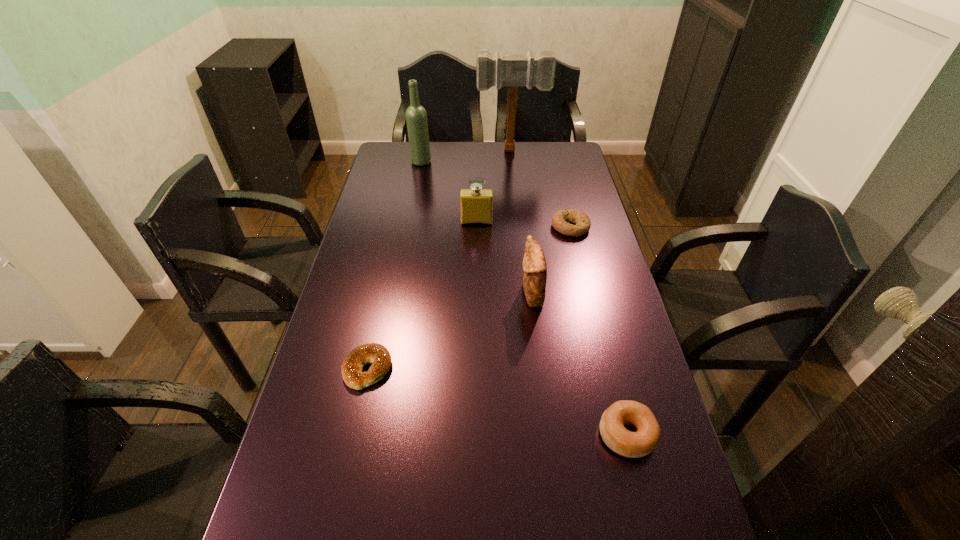
Locate which bagel is the second closest to the perfume. Please provide its 2D coordinates. Your answer should be formatted as a tuple, i.e. [(x, y)], where the tuple contains the x and y coordinates of a point satisfying the conditions above.

[(352, 367)]

The image size is (960, 540). What are the coordinates of `free location that satisfies the following two spatial constraints: 1. on the front side of the farthest bagel; 2. on the right side of the tallest object` in the screenshot? It's located at (519, 227).

Locate an element on the screen. This screenshot has width=960, height=540. free space in the image that satisfies the following two spatial constraints: 1. on the front side of the farthest bagel; 2. on the right side of the farthest object is located at coordinates (519, 227).